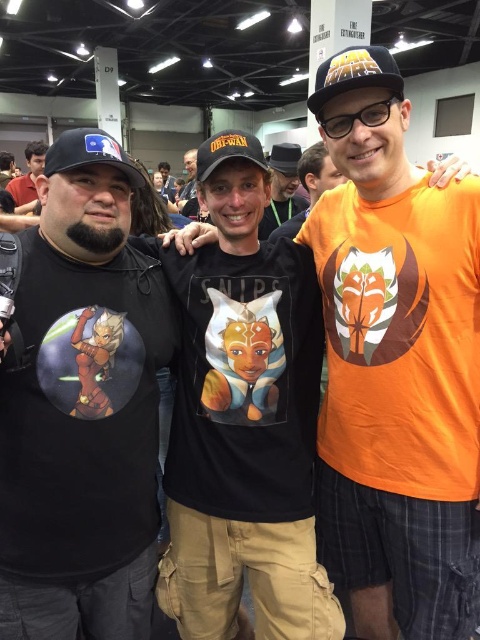
Question: Which of the following is the closest to the observer?

Choices:
 (A) matte black shirt at left
 (B) orange matte t-shirt at center
 (C) black matte t-shirt at left

Answer: (C)

Question: Which point appears farthest from the camera in this image?

Choices:
 (A) (35, 161)
 (B) (98, 150)
 (C) (257, 230)
 (D) (216, 145)

Answer: (A)

Question: Which is farther from the black matte t-shirt at left?

Choices:
 (A) black matte baseball cap at upper center
 (B) matte black cap at center

Answer: (B)

Question: Is black matte baseball cap at upper center further to the viewer compared to black matte baseball cap at center?

Choices:
 (A) no
 (B) yes

Answer: (A)

Question: Is matte black cap at center above matte black shirt at left?

Choices:
 (A) no
 (B) yes

Answer: (A)

Question: From the image, what is the correct spatial relationship of black matte baseball cap at center in relation to matte black shirt at left?

Choices:
 (A) below
 (B) above

Answer: (A)